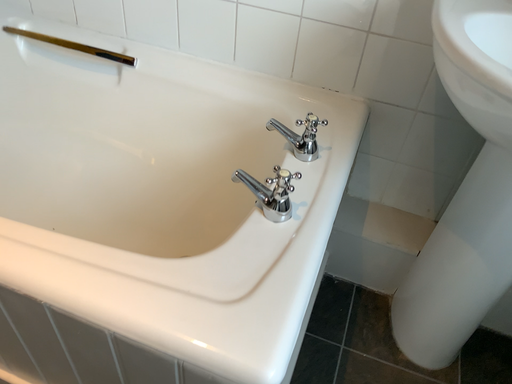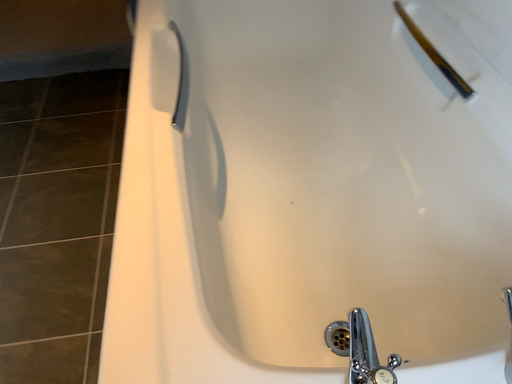
Question: Which way did the camera rotate in the video?

Choices:
 (A) rotated left
 (B) rotated right

Answer: (A)